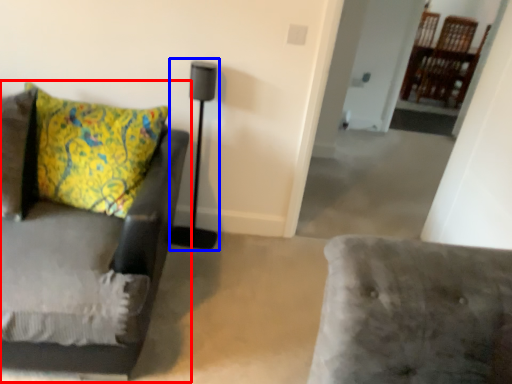
Question: Among these objects, which one is nearest to the camera, studio couch (highlighted by a red box) or table lamp (highlighted by a blue box)?

Choices:
 (A) studio couch
 (B) table lamp

Answer: (A)